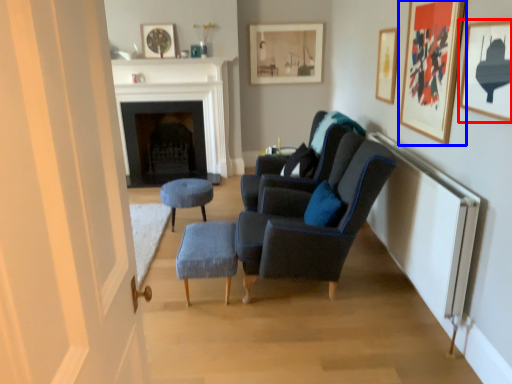
Question: Among these objects, which one is nearest to the camera, picture frame (highlighted by a red box) or picture frame (highlighted by a blue box)?

Choices:
 (A) picture frame
 (B) picture frame

Answer: (A)